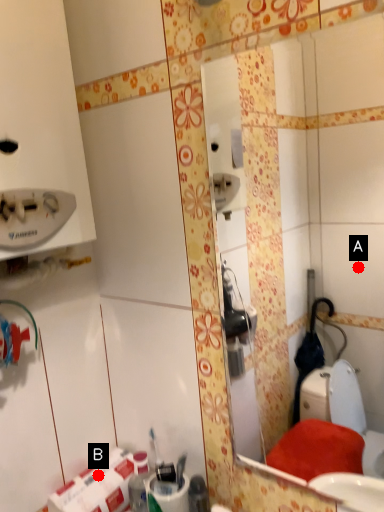
Question: Two points are circled on the image, labeled by A and B beside each circle. Which point is closer to the camera?

Choices:
 (A) A is closer
 (B) B is closer

Answer: (B)